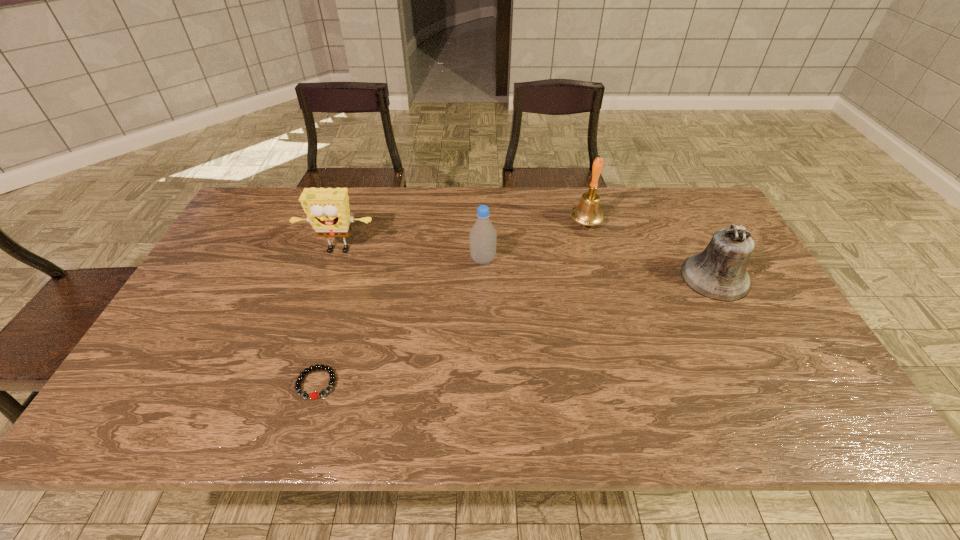
I want to click on the taller bell, so [587, 212].

Where is `the fourth object from left to right`? the fourth object from left to right is located at coordinates (587, 212).

What are the coordinates of `sponge` in the screenshot? It's located at (327, 210).

You are a GUI agent. You are given a task and a screenshot of the screen. Output one action in this format:
    pyautogui.click(x=<x>, y=<y>)
    Task: Click on the bottle
    
    Given the screenshot: What is the action you would take?
    pyautogui.click(x=483, y=237)

Locate an element on the screen. the right bell is located at coordinates (719, 273).

Where is `the shorter bell`? Image resolution: width=960 pixels, height=540 pixels. the shorter bell is located at coordinates (719, 273).

The image size is (960, 540). I want to click on the nearest object, so click(314, 395).

At what (x,y) coordinates should I click in order to perform the action: click on the shortest object. Please return your answer as a coordinate pair (x, y). The width and height of the screenshot is (960, 540). Looking at the image, I should click on [x=314, y=395].

This screenshot has width=960, height=540. What are the coordinates of `vacant area located on the left of the left bell` in the screenshot? It's located at (x=458, y=222).

In order to click on blank space located 0.300m on the front-facing side of the sponge in this screenshot , I will do `click(306, 345)`.